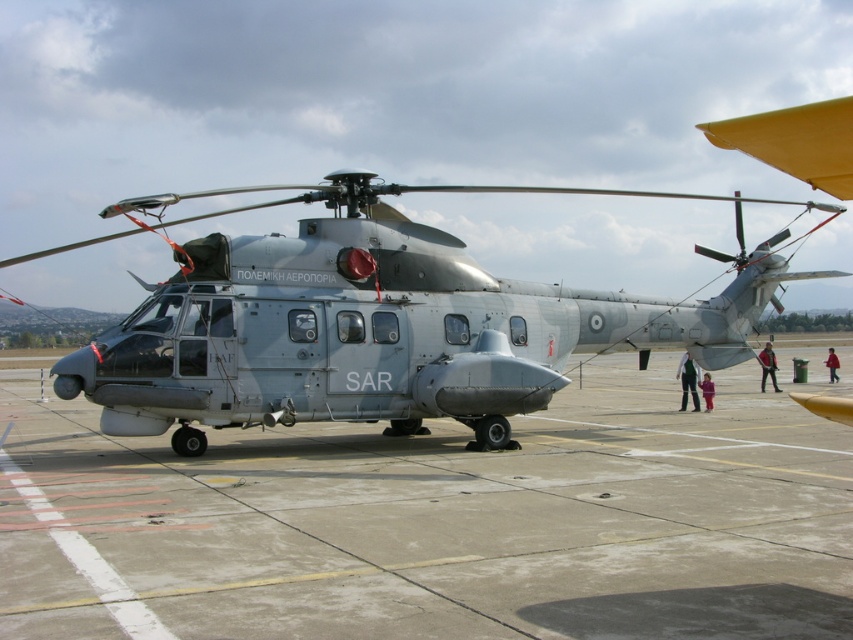
Between gray concrete tarmac at center and red cotton jacket at lower right, which one is positioned higher?

red cotton jacket at lower right is higher up.

Measure the distance between gray concrete tarmac at center and red cotton jacket at lower right.

14.63 meters

Which is behind, point (788, 604) or point (831, 362)?

The point (831, 362) is more distant.

Identify the location of gray concrete tarmac at center. The image size is (853, 640). (438, 524).

How distant is black fabric jacket at lower right from purple fabric pants at lower center?

black fabric jacket at lower right and purple fabric pants at lower center are 2.54 meters apart from each other.

Who is lower down, black fabric jacket at lower right or purple fabric pants at lower center?

Positioned lower is purple fabric pants at lower center.

The image size is (853, 640). What are the coordinates of `black fabric jacket at lower right` in the screenshot? It's located at (767, 365).

Is metallic gray helicopter at center shorter than purple fabric pants at lower center?

No, metallic gray helicopter at center is not shorter than purple fabric pants at lower center.

I want to click on metallic gray helicopter at center, so click(376, 323).

Locate an element on the screen. metallic gray helicopter at center is located at coordinates (376, 323).